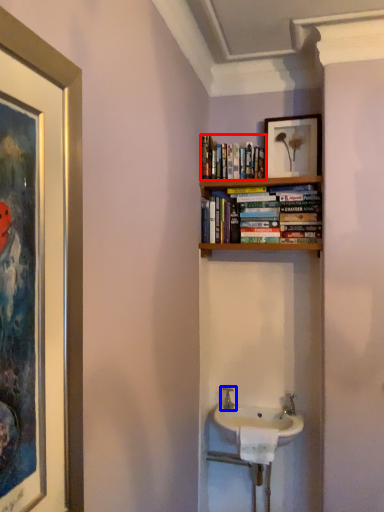
Question: Which object is closer to the camera taking this photo, book (highlighted by a red box) or tap (highlighted by a blue box)?

Choices:
 (A) book
 (B) tap

Answer: (A)